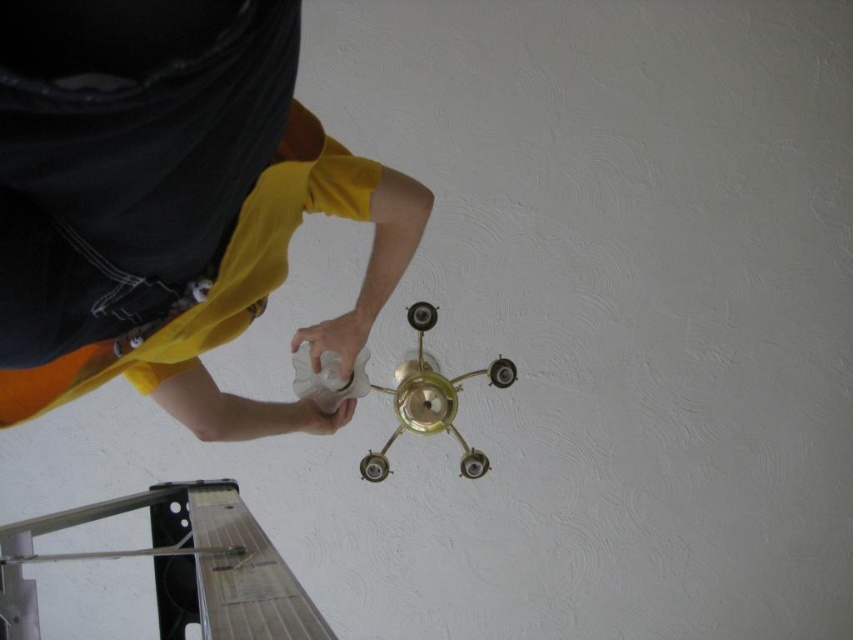
Is yellow matte shirt at upper center positioned in front of white matte bottle at center?

Yes, yellow matte shirt at upper center is in front of white matte bottle at center.

Is point (283, 212) closer to viewer compared to point (303, 394)?

Yes.

The height and width of the screenshot is (640, 853). Identify the location of yellow matte shirt at upper center. (169, 204).

Which is more to the right, gold metallic chandelier at center or white matte bottle at center?

Positioned to the right is gold metallic chandelier at center.

Between gold metallic chandelier at center and white matte bottle at center, which one is positioned higher?

white matte bottle at center is higher up.

Does point (467, 467) come in front of point (294, 362)?

No, it is behind (294, 362).

Locate an element on the screen. Image resolution: width=853 pixels, height=640 pixels. gold metallic chandelier at center is located at coordinates (431, 400).

Is point (315, 352) more distant than point (418, 305)?

No, it is not.

Can you confirm if yellow matte shirt at upper center is taller than gold metallic chandelier at center?

No, yellow matte shirt at upper center is not taller than gold metallic chandelier at center.

Is point (132, 141) less distant than point (403, 365)?

That is True.

You are a GUI agent. You are given a task and a screenshot of the screen. Output one action in this format:
    pyautogui.click(x=<x>, y=<y>)
    Task: Click on the yellow matte shirt at upper center
    The height and width of the screenshot is (640, 853).
    Given the screenshot: What is the action you would take?
    pyautogui.click(x=169, y=204)